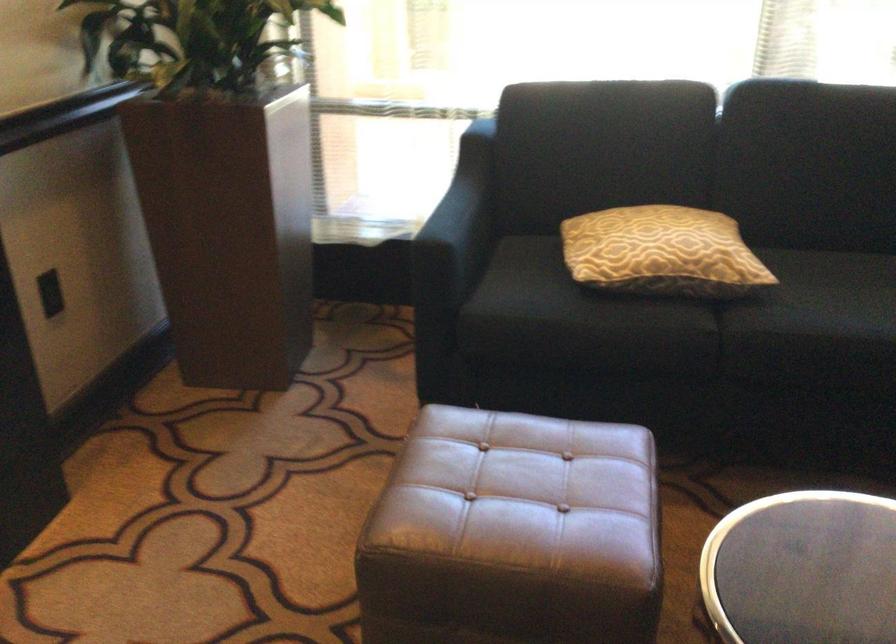
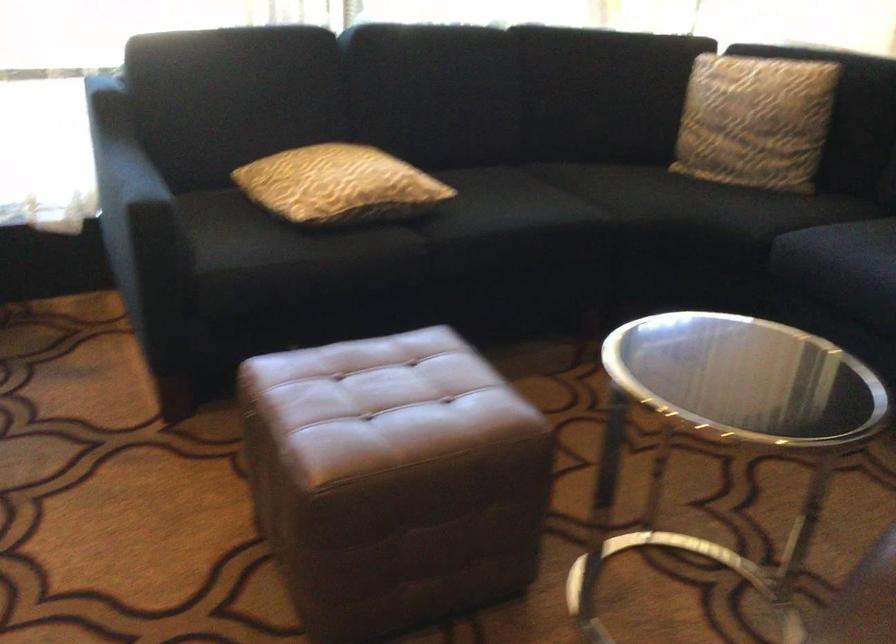
Where in the second image is the point corresponding to (451,196) from the first image?

(118, 162)